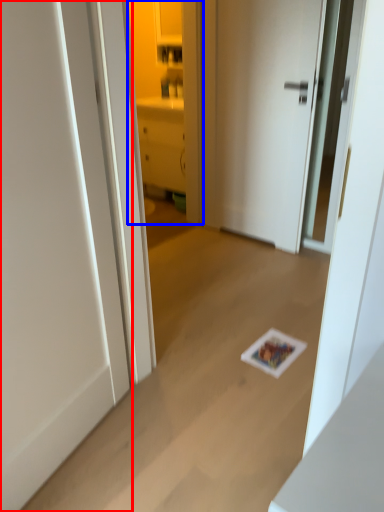
Question: Among these objects, which one is nearest to the camera, door (highlighted by a red box) or cabinetry (highlighted by a blue box)?

Choices:
 (A) door
 (B) cabinetry

Answer: (A)